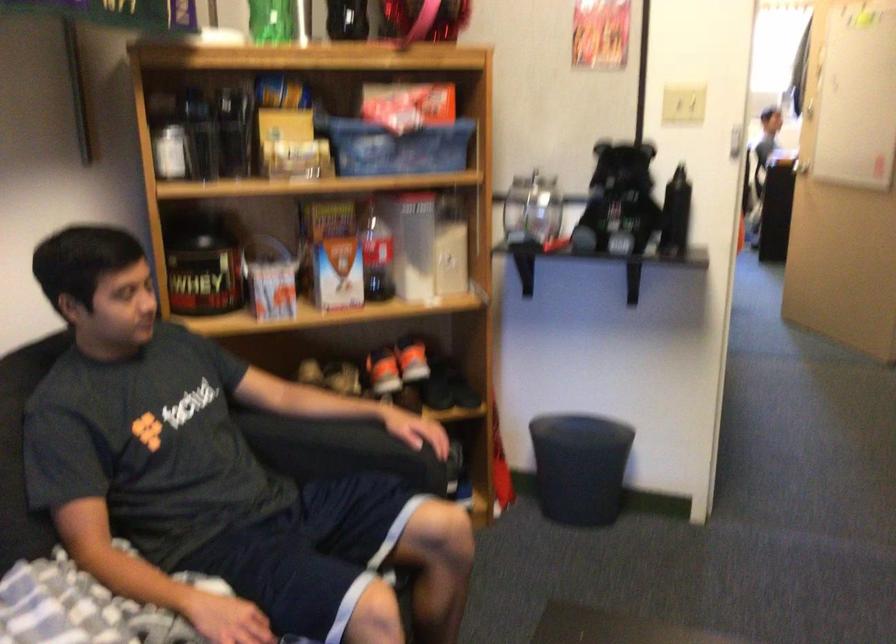
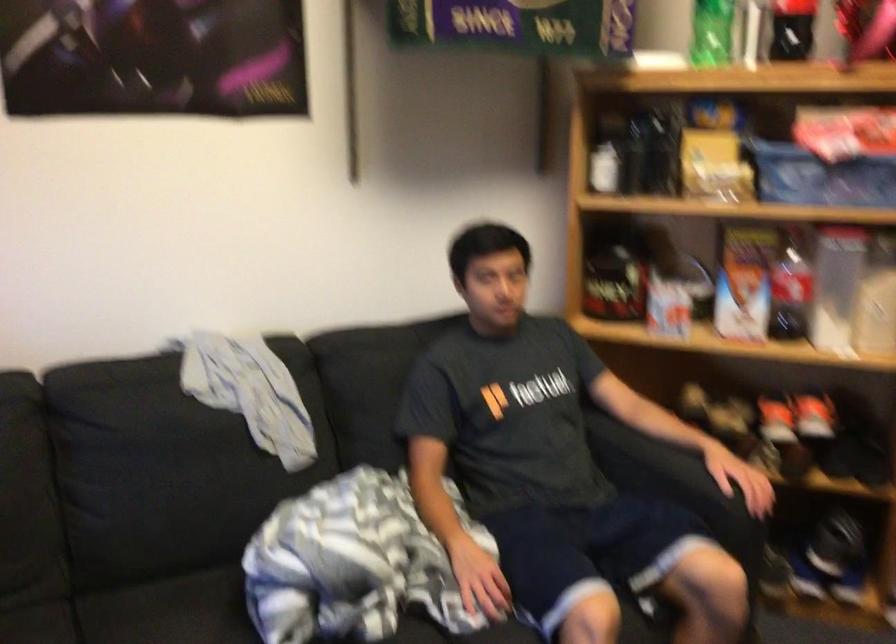
Question: I am providing you with two images of the same scene from different viewpoints. After the viewpoint changes to image2, which objects are now occluded?

Choices:
 (A) blue plastic bin
 (B) soda bottle
 (C) sofa armrest
 (D) none of these

Answer: (D)